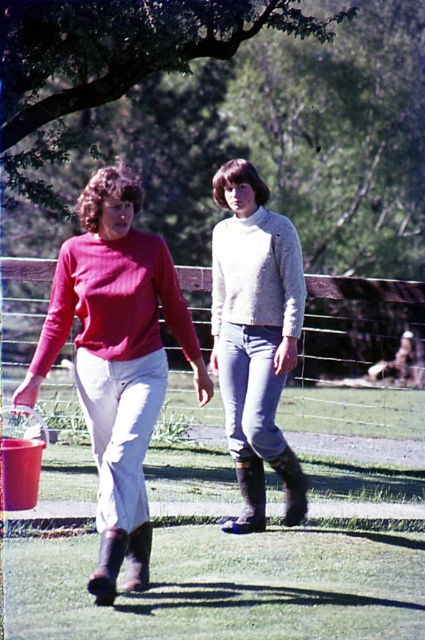
Is matte red sweater at center thinner than light gray knitted sweater at center?

Incorrect, matte red sweater at center's width is not less than light gray knitted sweater at center's.

In the scene shown: Which is above, matte red sweater at center or light gray knitted sweater at center?

light gray knitted sweater at center is higher up.

Who is more distant from viewer, (172, 326) or (291, 262)?

Positioned behind is point (291, 262).

Image resolution: width=425 pixels, height=640 pixels. Identify the location of matte red sweater at center. (113, 300).

Is point (132, 525) farther from viewer compared to point (258, 205)?

No, it is in front of (258, 205).

Is point (146, 417) positioned behind point (285, 321)?

No, (146, 417) is closer to viewer.

Where is `matte red sweater at left`? The image size is (425, 640). matte red sweater at left is located at coordinates (116, 358).

Does matte red sweater at left have a greater height compared to matte red sweater at center?

Indeed, matte red sweater at left has a greater height compared to matte red sweater at center.

Image resolution: width=425 pixels, height=640 pixels. In order to click on matte red sweater at left in this screenshot , I will do `click(116, 358)`.

Identify the location of matte red sweater at left. (116, 358).